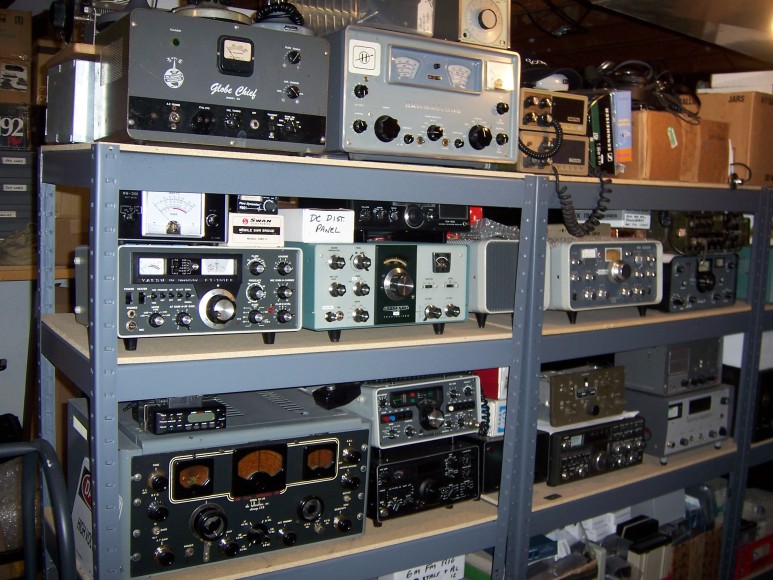
Find the location of a particular element. Image resolution: width=773 pixels, height=580 pixels. place to store items is located at coordinates (363, 173), (638, 193), (342, 345), (624, 316), (414, 522), (617, 474).